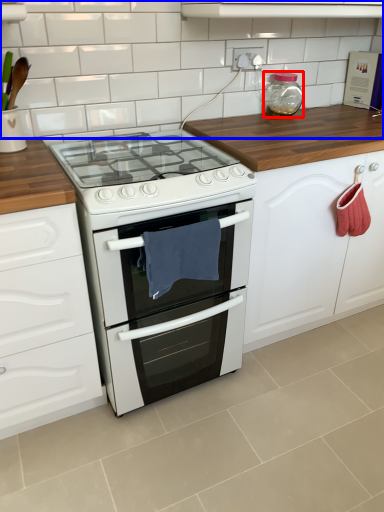
Question: Which point is closer to the camera, bottle (highlighted by a red box) or tile (highlighted by a blue box)?

Choices:
 (A) bottle
 (B) tile

Answer: (B)